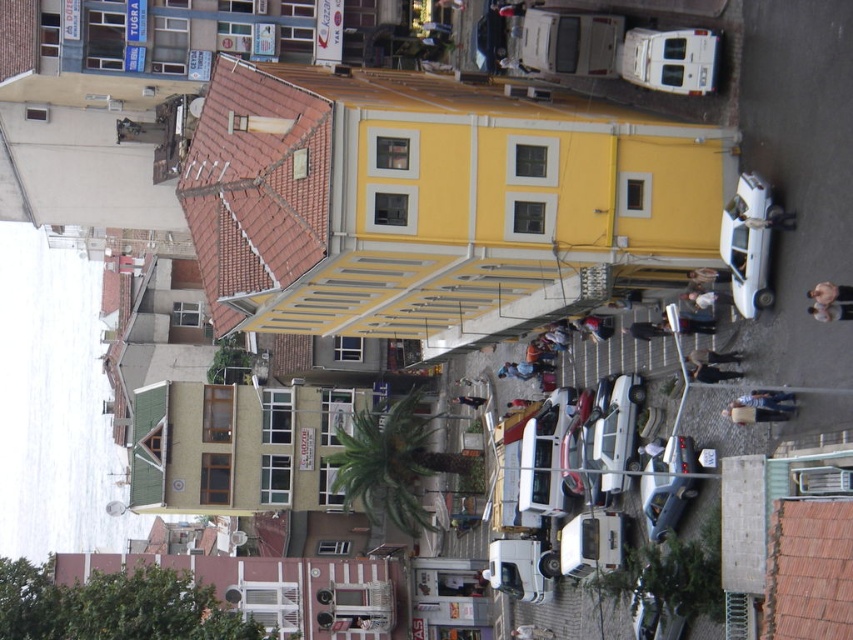
You are a delivery person trying to place a package exactly at the center of the image. However, there is a smooth beige doll at center in the way. Where should you adjust your delivery path to avoid the doll while still aiming for the center?

The smooth beige doll at center is located at point [830,301], so you should adjust your delivery path slightly upwards and to the right to reach the true center of the image while avoiding the doll.

You are standing at the entrance of the yellow building with white windows. You need to find the white matte van at center. Based on the coordinates provided, in which direction should you walk to locate it?

The white matte van at center is located at coordinates point (544, 456). Since you are at the entrance of the yellow building, which is in the center of the image, you should walk towards the lower right direction to reach the white matte van at center.